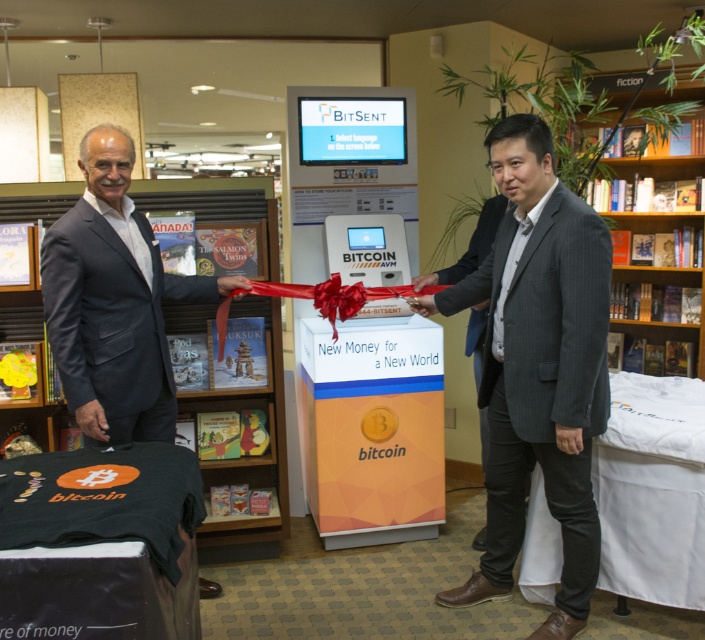
Is wooden bookshelf at upper right further to camera compared to red silk ribbon at center?

Yes.

Is wooden bookshelf at upper right thinner than red silk ribbon at center?

Yes, wooden bookshelf at upper right is thinner than red silk ribbon at center.

The image size is (705, 640). I want to click on wooden bookshelf at upper right, so click(x=670, y=333).

Is point (521, 244) positioned before point (226, 330)?

Yes, point (521, 244) is in front of point (226, 330).

Is point (587, 246) farther from viewer compared to point (407, 292)?

No, (587, 246) is closer to viewer.

You are a GUI agent. You are given a task and a screenshot of the screen. Output one action in this format:
    pyautogui.click(x=<x>, y=<y>)
    Task: Click on the gray wool suit at center
    This screenshot has width=705, height=640.
    Given the screenshot: What is the action you would take?
    pyautogui.click(x=539, y=369)

Does black suit at left have a lesser width compared to wooden bookshelf at upper right?

Correct, black suit at left's width is less than wooden bookshelf at upper right's.

At what (x,y) coordinates should I click in order to perform the action: click on black suit at left. Please return your answer as a coordinate pair (x, y). Looking at the image, I should click on (114, 301).